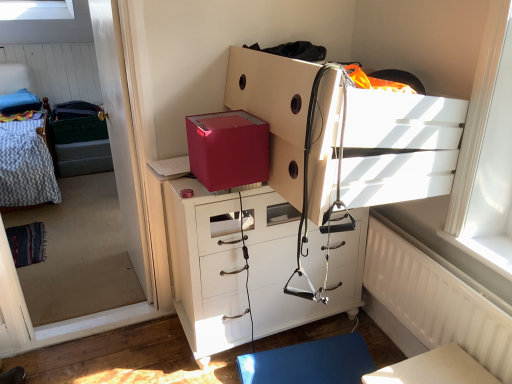
Where is `blank area to the left of transparent glass window screen at left`? blank area to the left of transparent glass window screen at left is located at coordinates 57,309.